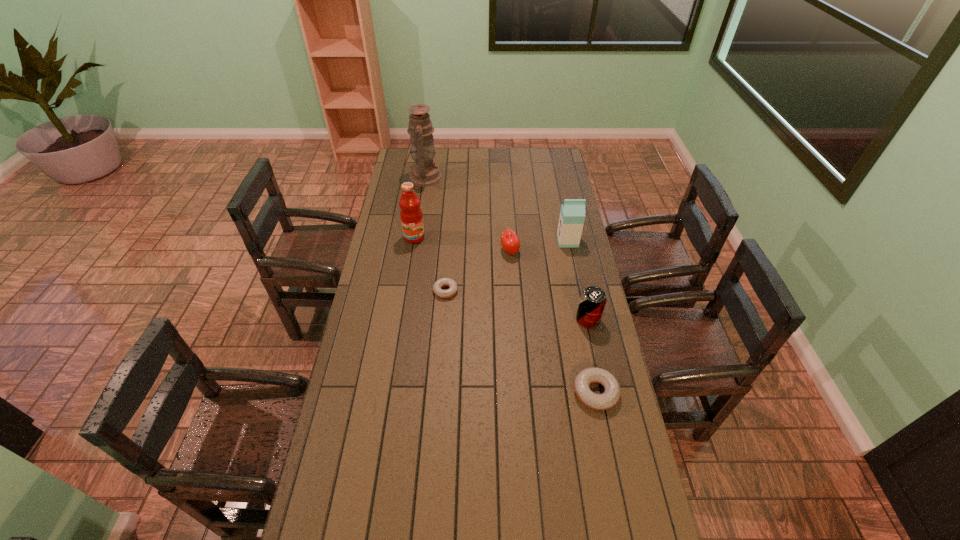
What are the coordinates of `the second nearest object` in the screenshot? It's located at (593, 299).

In order to click on milk carton in this screenshot , I will do click(x=572, y=215).

The image size is (960, 540). What are the coordinates of `free space located on the right of the shortest object` in the screenshot? It's located at (533, 291).

At what (x,y) coordinates should I click in order to perform the action: click on vacant space located 0.280m on the front of the sixth tallest object. Please return your answer as a coordinate pair (x, y). The width and height of the screenshot is (960, 540). Looking at the image, I should click on (619, 508).

At what (x,y) coordinates should I click in order to perform the action: click on vacant space situated on the right of the third shortest object. Please return your answer as a coordinate pair (x, y). Looking at the image, I should click on (531, 251).

Locate an element on the screen. blank space located on the right of the farthest object is located at coordinates (517, 178).

Identify the location of free space located on the front label of the fruit juice. This screenshot has width=960, height=540. (410, 265).

Locate an element on the screen. vacant region located 0.150m on the front of the soda can is located at coordinates (597, 364).

Where is `free space located 0.280m on the left of the milk carton`? The width and height of the screenshot is (960, 540). free space located 0.280m on the left of the milk carton is located at coordinates (495, 241).

Where is `object that is at the far edge`? This screenshot has height=540, width=960. object that is at the far edge is located at coordinates (424, 173).